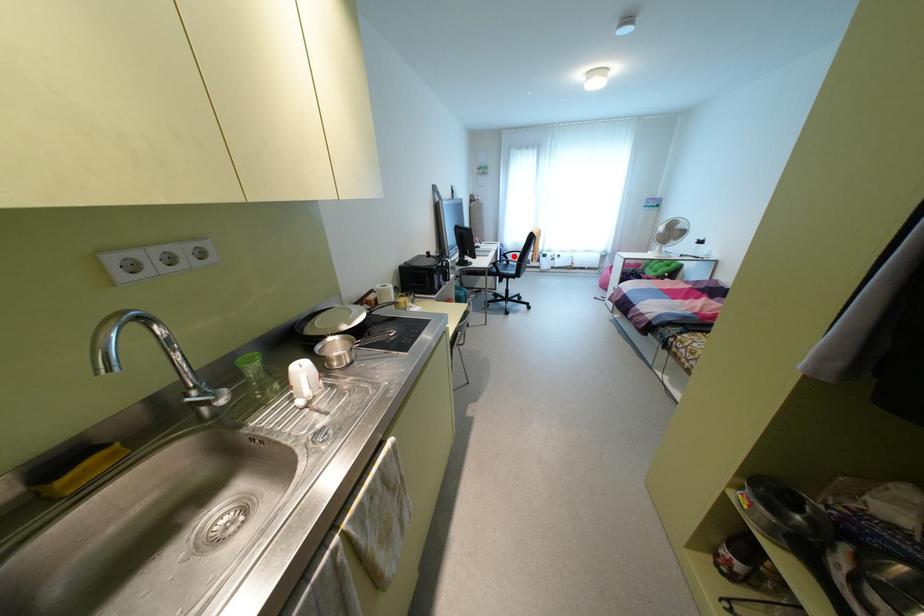
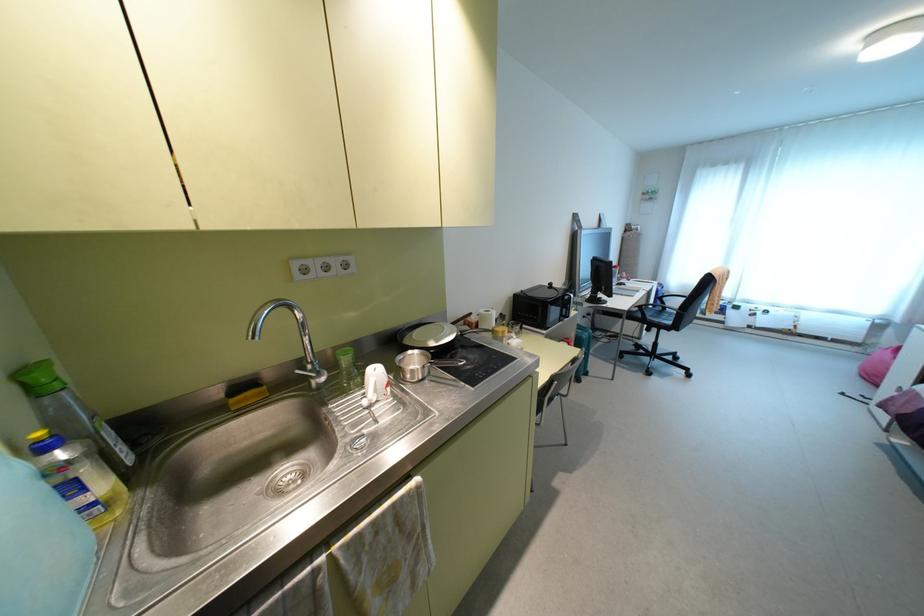
Locate, in the second image, the point that corresponds to the highlighted location in the first image.

(674, 302)